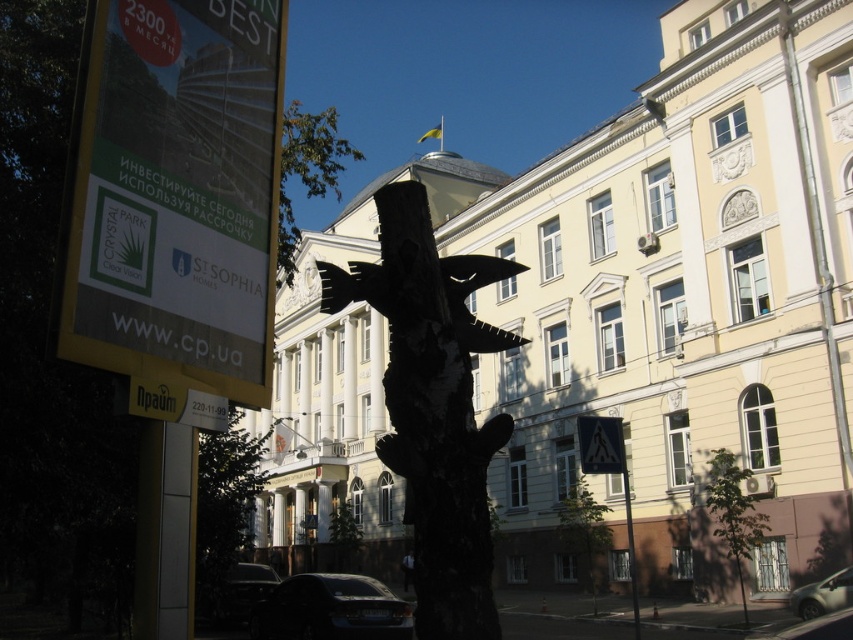
You are a pedestrian standing on the sidewalk in front of the building. You see a yellow paper sign at upper left and a black plastic triangle at lower right. Which object is positioned higher up in the scene?

The yellow paper sign at upper left is positioned higher up in the scene than the black plastic triangle at lower right.

You are a visitor trying to locate the entrance to the building. You see the yellow paper sign at upper left and the green leafy tree at upper center in your view. Which object is smaller in size and might be harder to notice from a distance?

The yellow paper sign at upper left occupies less space than the green leafy tree at upper center, so it is smaller and harder to notice from a distance.